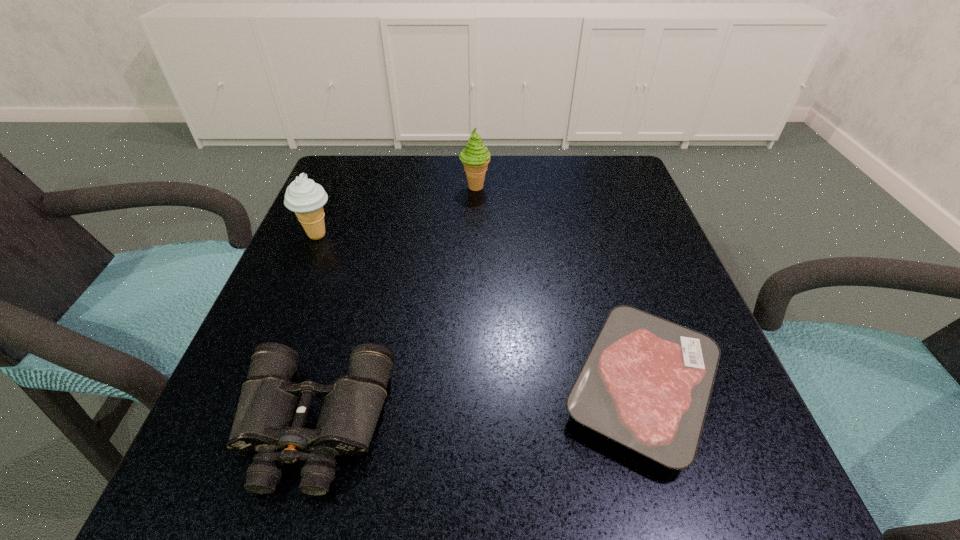
The image size is (960, 540). Find the location of `the farthest object`. the farthest object is located at coordinates click(x=475, y=157).

At what (x,y) coordinates should I click in order to perform the action: click on the right icecream. Please return your answer as a coordinate pair (x, y). This screenshot has height=540, width=960. Looking at the image, I should click on (475, 157).

Identify the location of the nearer icecream. The height and width of the screenshot is (540, 960). (303, 196).

What are the coordinates of `the third nearest object` in the screenshot? It's located at (303, 196).

Identify the location of binoculars. (272, 411).

Where is `steak`? steak is located at coordinates [x=646, y=383].

I want to click on the rightmost object, so click(x=646, y=383).

In order to click on free location located 0.400m on the front of the farther icecream in this screenshot , I will do [x=472, y=335].

At what (x,y) coordinates should I click in order to perform the action: click on vacant region located on the back of the second farthest object. Please return your answer as a coordinate pair (x, y). Image resolution: width=960 pixels, height=540 pixels. Looking at the image, I should click on (340, 182).

Find the location of `vacant region located on the left of the rightmost object`. vacant region located on the left of the rightmost object is located at coordinates (428, 387).